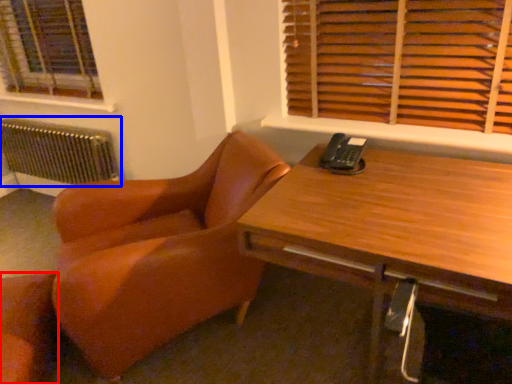
Question: Which of the following is the farthest to the observer, chair (highlighted by a red box) or radiator (highlighted by a blue box)?

Choices:
 (A) chair
 (B) radiator

Answer: (B)